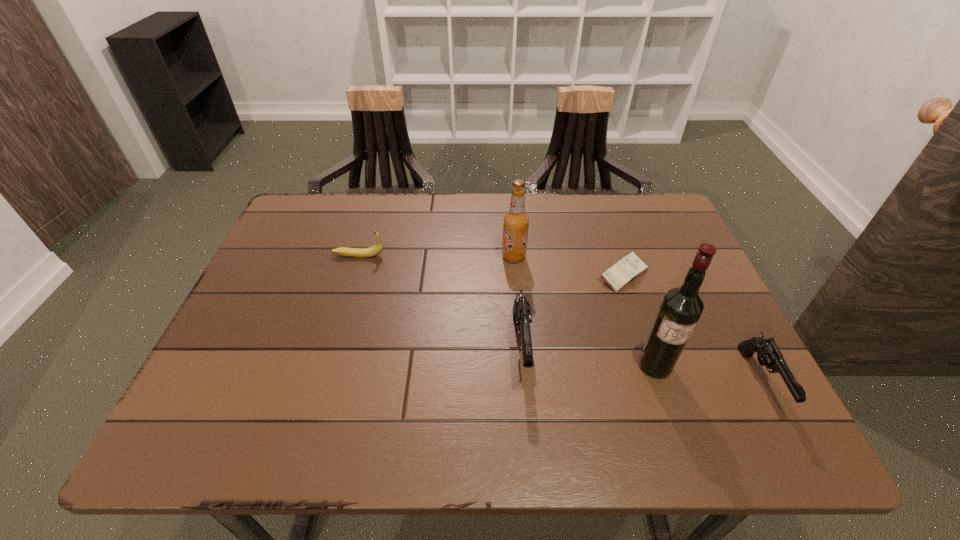
Identify the location of vacant point located between the shortest object and the tallest object. Image resolution: width=960 pixels, height=540 pixels. (639, 320).

Identify the location of free space that is in between the shorter gun and the second tallest object. (636, 319).

You are a GUI agent. You are given a task and a screenshot of the screen. Output one action in this format:
    pyautogui.click(x=<x>, y=<y>)
    Task: Click on the object that ranks as the second closest to the diary
    This screenshot has height=540, width=960.
    Given the screenshot: What is the action you would take?
    pyautogui.click(x=681, y=307)

Image resolution: width=960 pixels, height=540 pixels. I want to click on object that is the nearest to the beer bottle, so click(521, 307).

Identify the location of free point that satisfies the following two spatial constraints: 1. at the stem of the diary; 2. on the right side of the leftmost object. (353, 275).

Find the location of a particular element. vacant area in the image that satisfies the following two spatial constraints: 1. on the back side of the shortest object; 2. on the front label of the beer bottle is located at coordinates (617, 256).

Locate an element on the screen. The height and width of the screenshot is (540, 960). vacant space that satisfies the following two spatial constraints: 1. on the front label of the fifth shortest object; 2. at the end of the barrel of the fourth shortest object is located at coordinates (521, 348).